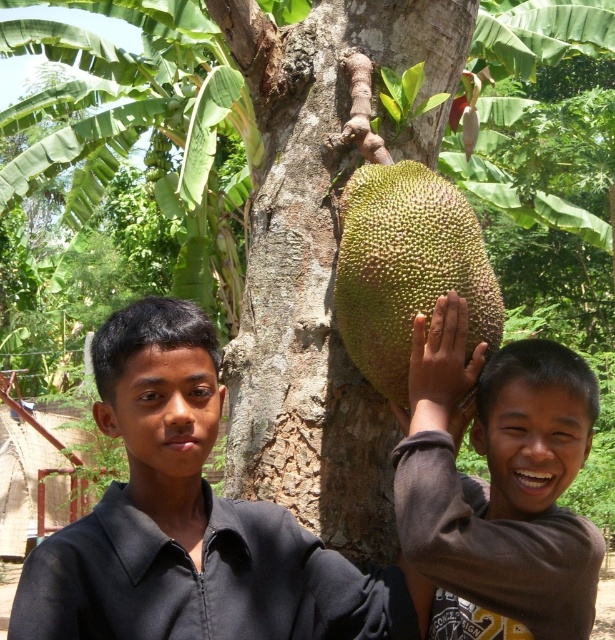
Does black matte shirt at left appear on the left side of green spiky jackfruit at center?

Yes, black matte shirt at left is to the left of green spiky jackfruit at center.

Can you confirm if black matte shirt at left is shorter than green spiky jackfruit at center?

No, black matte shirt at left is not shorter than green spiky jackfruit at center.

Between point (121, 308) and point (402, 346), which one is positioned behind?

The point (121, 308) is more distant.

Identify the location of black matte shirt at left. (191, 522).

Which is behind, point (132, 397) or point (423, 388)?

Point (423, 388)

Measure the distance between black matte shirt at left and camera.

The distance of black matte shirt at left from camera is 3.25 meters.

Find the location of a particular element. black matte shirt at left is located at coordinates (191, 522).

Between brown matte jackfruit at center and green spiky jackfruit at center, which one appears on the right side from the viewer's perspective?

From the viewer's perspective, brown matte jackfruit at center appears more on the right side.

Does brown matte jackfruit at center have a smaller size compared to green spiky jackfruit at center?

Incorrect, brown matte jackfruit at center is not smaller in size than green spiky jackfruit at center.

Image resolution: width=615 pixels, height=640 pixels. In order to click on brown matte jackfruit at center in this screenshot , I will do pos(496,483).